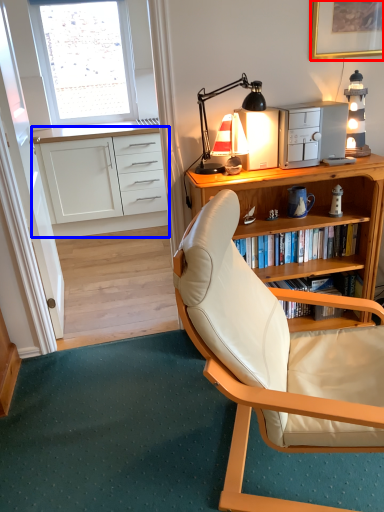
Question: Among these objects, which one is farthest to the camera, picture frame (highlighted by a red box) or cabinetry (highlighted by a blue box)?

Choices:
 (A) picture frame
 (B) cabinetry

Answer: (B)